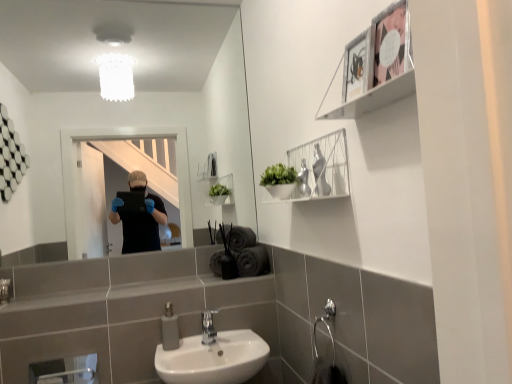
Question: Considering their positions, is gray matte soap dispenser at lower center located in front of or behind metallic silver frame at upper right, the 2th cabinet positioned from the back?

Choices:
 (A) behind
 (B) front

Answer: (A)

Question: From a real-world perspective, is gray matte soap dispenser at lower center above or below metallic silver frame at upper right, which ranks as the 2th cabinet in bottom-to-top order?

Choices:
 (A) below
 (B) above

Answer: (A)

Question: Estimate the real-world distances between objects in this image. Which object is farther from the clear glass mirror at upper center?

Choices:
 (A) metallic silver picture frame at upper right
 (B) metallic silver frame at upper right, the first cabinet from the top
 (C) gray matte soap dispenser at lower center
 (D) white wire shelf at upper center, which is counted as the 1th cabinet, starting from the back
 (E) satin nickel faucet at center

Answer: (A)

Question: Based on their relative distances, which object is farther from the satin nickel faucet at center?

Choices:
 (A) clear glass mirror at upper center
 (B) white wire shelf at upper center, the first cabinet positioned from the bottom
 (C) gray matte soap dispenser at lower center
 (D) metallic silver frame at upper right, which ranks as the 2th cabinet in bottom-to-top order
 (E) metallic silver picture frame at upper right

Answer: (A)